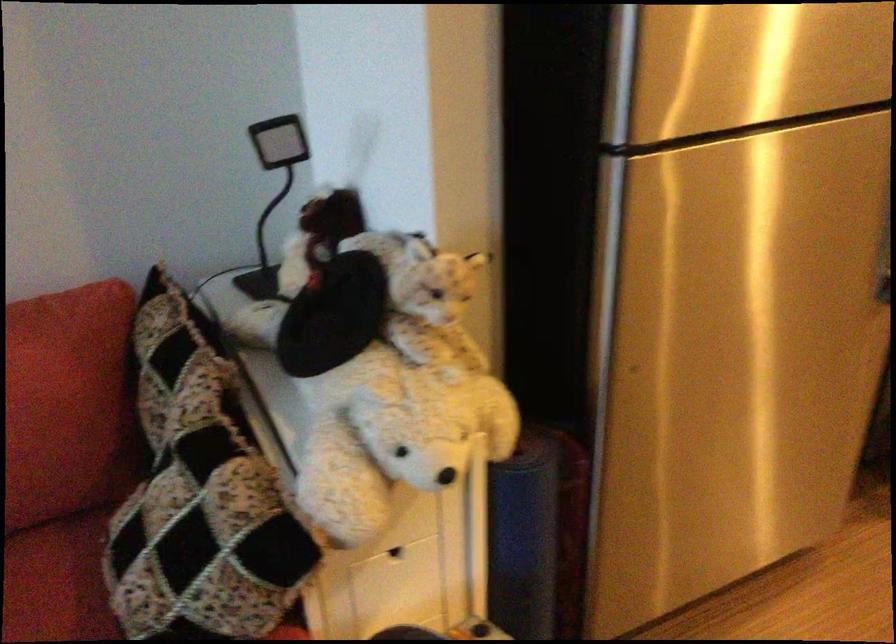
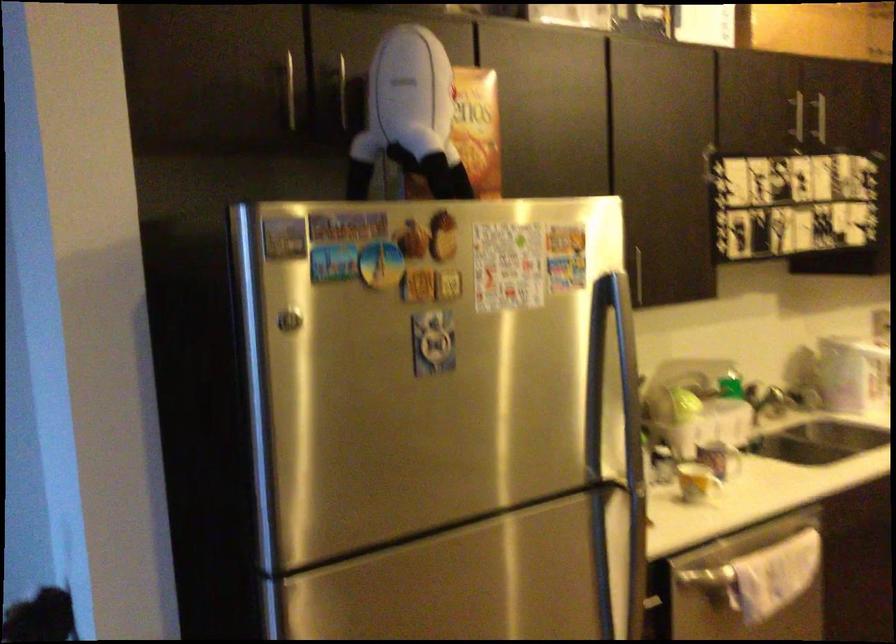
Question: The images are taken continuously from a first-person perspective. In which direction are you moving?

Choices:
 (A) Left
 (B) Right
 (C) Forward
 (D) Backward

Answer: (B)